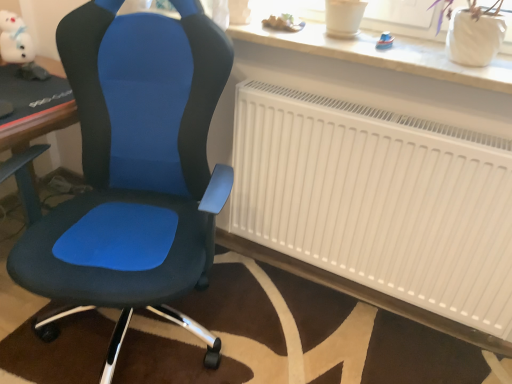
Question: Does wooden toy boat at upper center, the second toy positioned from the left, have a lesser height compared to white matte radiator at center?

Choices:
 (A) yes
 (B) no

Answer: (A)

Question: Can you confirm if wooden toy boat at upper center, placed as the second toy when sorted from right to left, is positioned to the left of white matte radiator at center?

Choices:
 (A) no
 (B) yes

Answer: (B)

Question: From a real-world perspective, does wooden toy boat at upper center, placed as the second toy when sorted from right to left, stand above white matte radiator at center?

Choices:
 (A) no
 (B) yes

Answer: (B)

Question: From a real-world perspective, is wooden toy boat at upper center, which ranks as the second toy in front-to-back order, physically below white matte radiator at center?

Choices:
 (A) no
 (B) yes

Answer: (A)

Question: Does wooden toy boat at upper center, which ranks as the second toy in back-to-front order, have a smaller size compared to white matte radiator at center?

Choices:
 (A) yes
 (B) no

Answer: (A)

Question: In terms of width, does white matte radiator at center look wider or thinner when compared to matte blue fabric chair at center?

Choices:
 (A) wide
 (B) thin

Answer: (B)

Question: Relative to matte blue fabric chair at center, is white matte radiator at center in front or behind?

Choices:
 (A) front
 (B) behind

Answer: (B)

Question: Is white matte radiator at center taller or shorter than matte blue fabric chair at center?

Choices:
 (A) tall
 (B) short

Answer: (B)

Question: Is white matte radiator at center spatially inside matte blue fabric chair at center, or outside of it?

Choices:
 (A) inside
 (B) outside

Answer: (B)

Question: Would you say blue plastic toy at upper right, which ranks as the first toy in front-to-back order, is to the left or to the right of white matte radiator at center in the picture?

Choices:
 (A) left
 (B) right

Answer: (A)

Question: Is blue plastic toy at upper right, acting as the 3th toy starting from the left, in front of or behind white matte radiator at center in the image?

Choices:
 (A) front
 (B) behind

Answer: (B)

Question: From a real-world perspective, is blue plastic toy at upper right, which appears as the 3th toy when viewed from the back, positioned above or below white matte radiator at center?

Choices:
 (A) above
 (B) below

Answer: (A)

Question: Considering the positions of blue plastic toy at upper right, arranged as the 1th toy when viewed from the right, and white matte radiator at center in the image, is blue plastic toy at upper right, arranged as the 1th toy when viewed from the right, wider or thinner than white matte radiator at center?

Choices:
 (A) wide
 (B) thin

Answer: (B)

Question: In terms of width, does wooden toy boat at upper center, placed as the second toy when sorted from right to left, look wider or thinner when compared to white plush toy at upper left, the first toy positioned from the left?

Choices:
 (A) thin
 (B) wide

Answer: (B)

Question: Considering the relative positions of wooden toy boat at upper center, which ranks as the second toy in back-to-front order, and white plush toy at upper left, the first toy positioned from the left, in the image provided, is wooden toy boat at upper center, which ranks as the second toy in back-to-front order, to the left or to the right of white plush toy at upper left, the first toy positioned from the left,?

Choices:
 (A) left
 (B) right

Answer: (B)